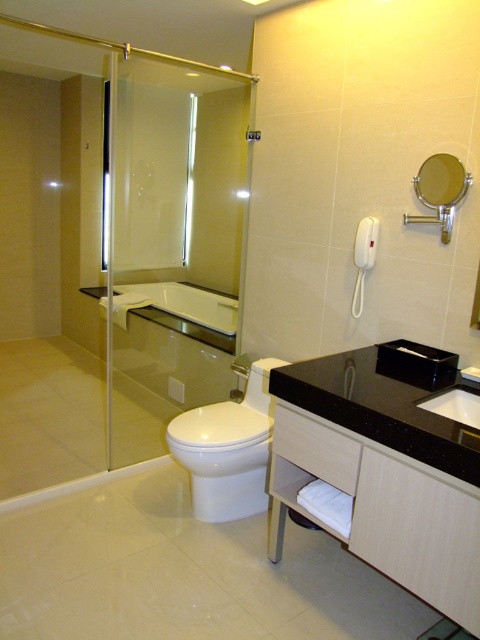
You are standing in the bathroom and need to wash your hands. The black granite sink at center is where you need to go. Based on the scene description, can you determine the direction you should move from your current position to reach the sink?

The black granite sink at center is located at point coordinates, so you should move towards the center of the bathroom to reach it.

You are a delivery person who needs to place a 5.5 feet long package between the transparent glass shower door at left and the black marble vanity at lower right. Can you fit the package horizontally between them?

The distance between the transparent glass shower door at left and the black marble vanity at lower right is 6.14 feet. Since the package is 5.5 feet long, it can fit horizontally between them as there is enough space.